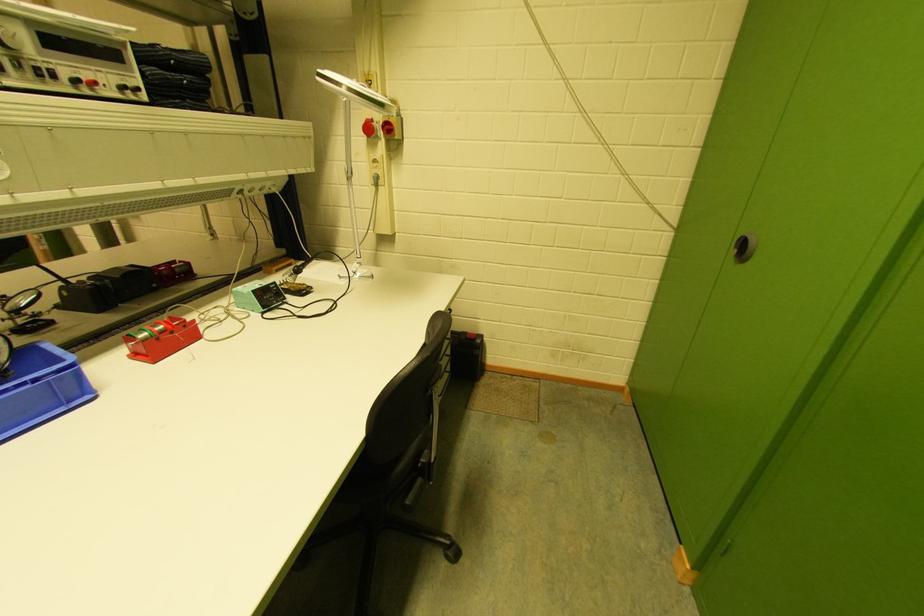
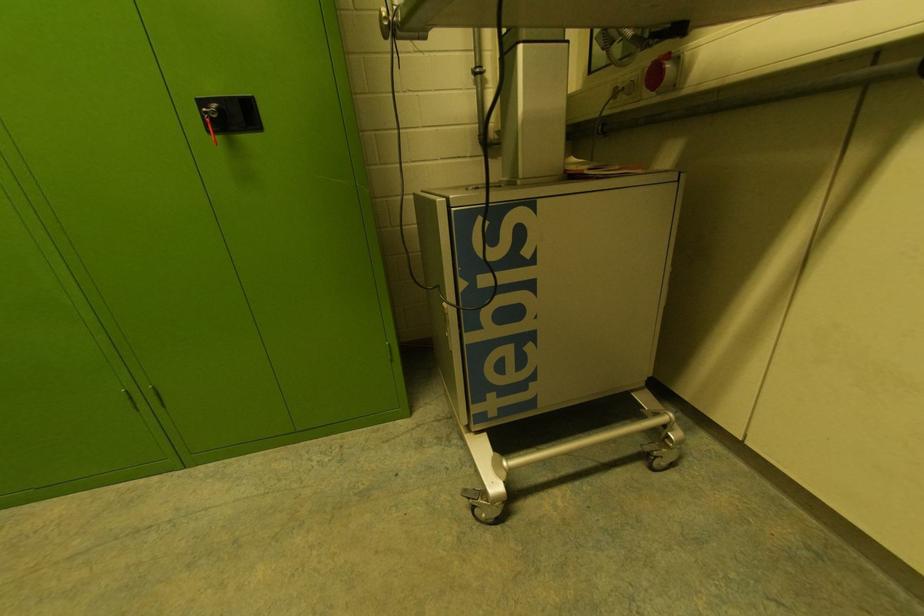
How did the camera likely rotate?

The camera's rotation is toward right-down.